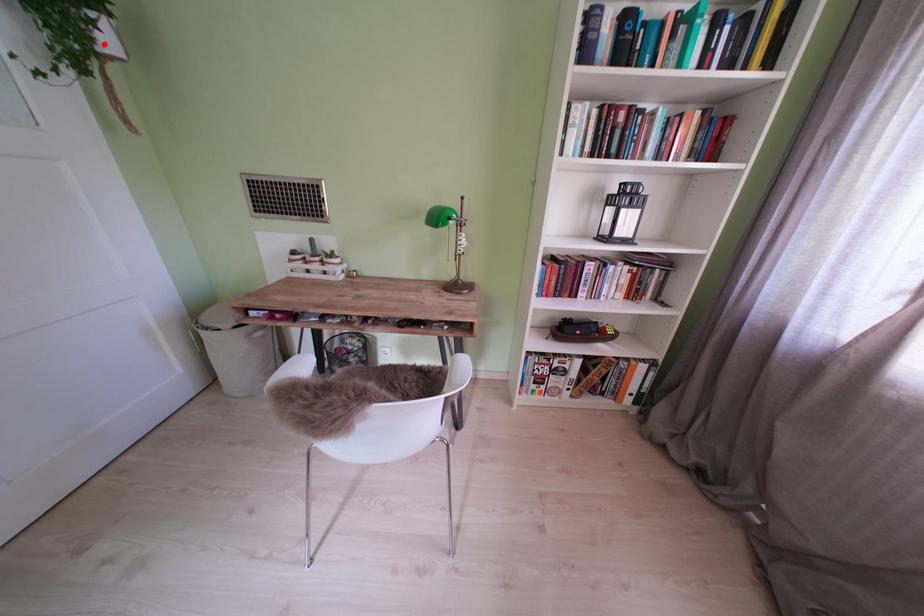
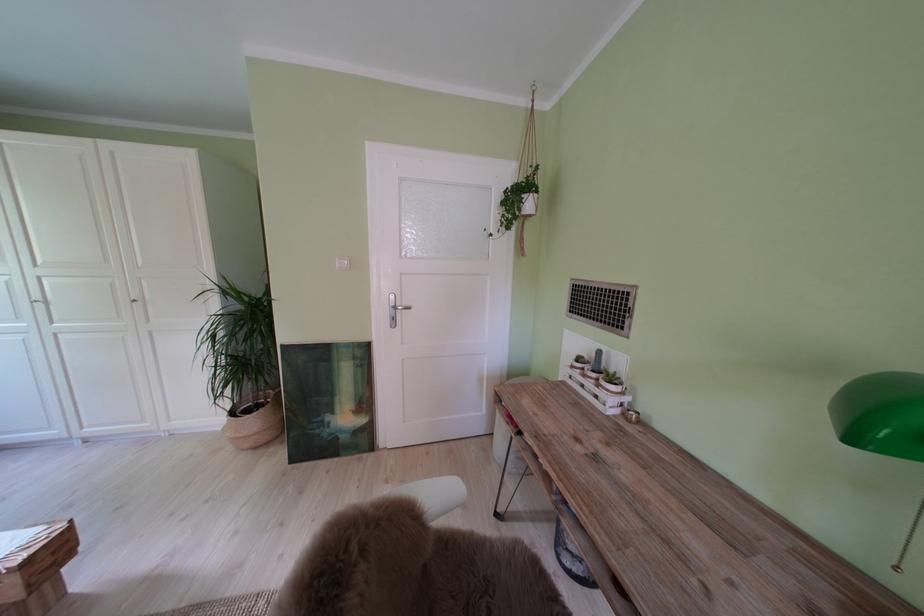
Question: I am providing you with two images of the same scene from different viewpoints. A red point is marked on the first image. Can you still see the location of the red point in image 2?

Choices:
 (A) Yes
 (B) No

Answer: (A)